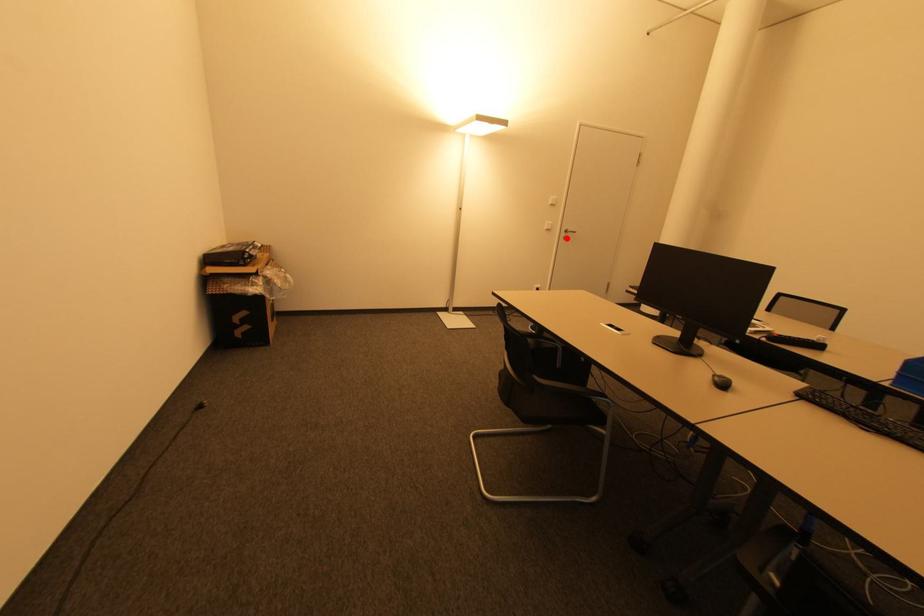
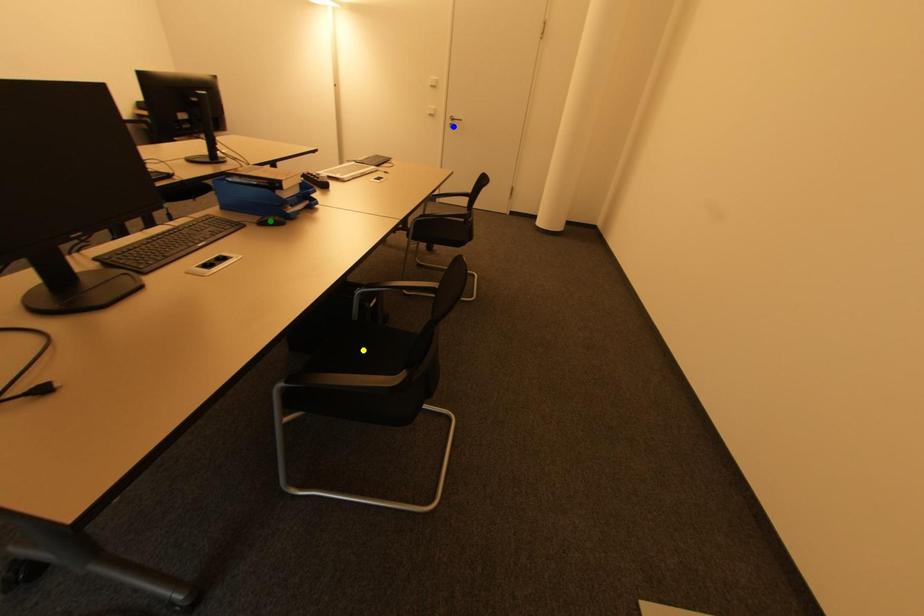
Question: I am providing you with two images of the same scene from different viewpoints. A red point is marked on the first image. You are given multiple points on the second image. Which mark in image 2 goes with the point in image 1?

Choices:
 (A) yellow point
 (B) green point
 (C) blue point

Answer: (C)